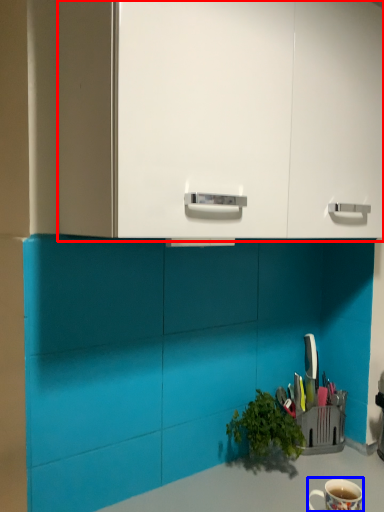
Question: Which of the following is the farthest to the observer, dresser (highlighted by a red box) or coffee cup (highlighted by a blue box)?

Choices:
 (A) dresser
 (B) coffee cup

Answer: (B)